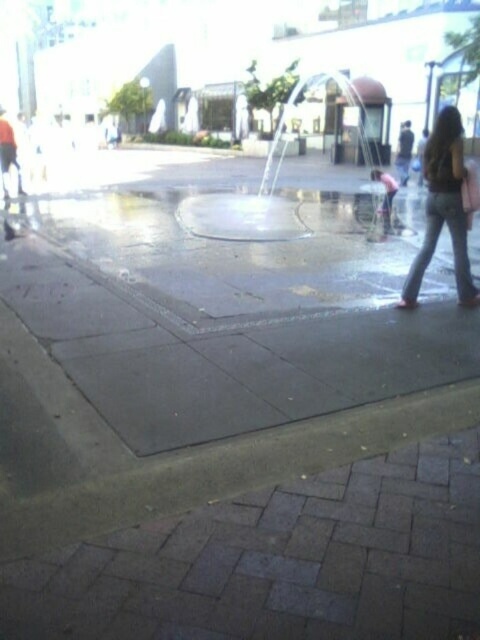
Consider the image. Between transparent glass fountain at center and denim jeans at right, which one appears on the right side from the viewer's perspective?

From the viewer's perspective, transparent glass fountain at center appears more on the right side.

Can you confirm if transparent glass fountain at center is positioned below denim jeans at right?

Actually, transparent glass fountain at center is above denim jeans at right.

Who is more forward, (240, 212) or (429, 236)?

Point (429, 236) is more forward.

Find the location of `transparent glass fountain at center`. transparent glass fountain at center is located at coordinates (282, 164).